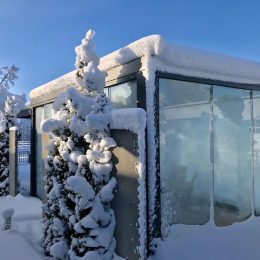
At what (x,y) coordinates should I click in order to perform the action: click on door. Please return your answer as a coordinate pair (x, y). The image size is (260, 260). Looking at the image, I should click on (194, 157).